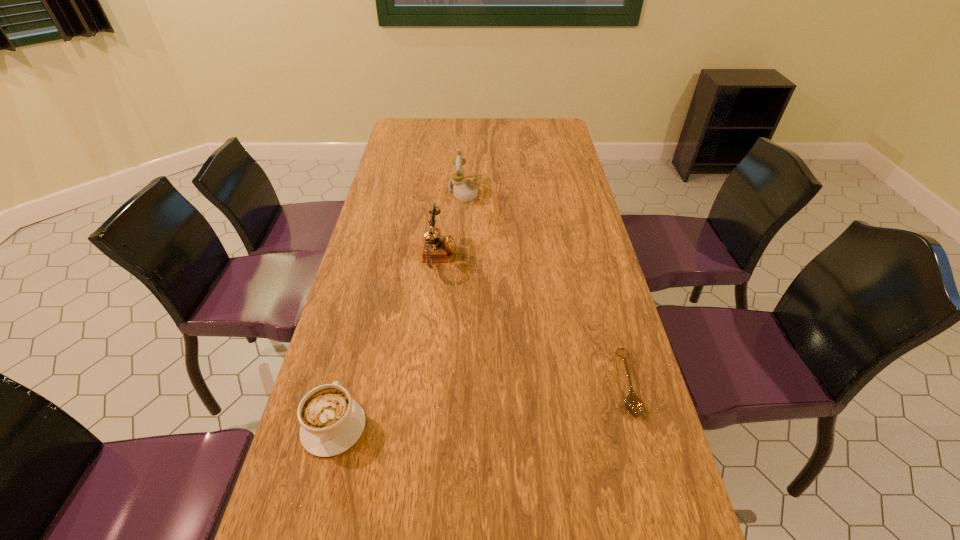
The image size is (960, 540). Find the location of `vacant area that lies between the ladle and the third nearest object`. vacant area that lies between the ladle and the third nearest object is located at coordinates (533, 321).

The height and width of the screenshot is (540, 960). I want to click on unoccupied area between the leftmost object and the nearer telephone, so click(387, 342).

Find the location of a particular element. free spot between the ladle and the nearer telephone is located at coordinates (533, 321).

Where is `free area in between the third tallest object and the farthest object`? free area in between the third tallest object and the farthest object is located at coordinates (398, 308).

Locate an element on the screen. The height and width of the screenshot is (540, 960). vacant area that lies between the cappuccino and the farthest object is located at coordinates (398, 308).

Image resolution: width=960 pixels, height=540 pixels. In order to click on unoccupied position between the ladle and the third nearest object in this screenshot , I will do `click(533, 321)`.

I want to click on free spot between the second shortest object and the shortest object, so click(x=480, y=404).

You are a GUI agent. You are given a task and a screenshot of the screen. Output one action in this format:
    pyautogui.click(x=<x>, y=<y>)
    Task: Click on the vacant point located between the rightmost object and the third tallest object
    Image resolution: width=960 pixels, height=540 pixels.
    Given the screenshot: What is the action you would take?
    pyautogui.click(x=480, y=404)

Locate an element on the screen. object that stands as the closest to the cappuccino is located at coordinates (436, 248).

Identify the location of the second closest object to the nearer telephone. (331, 422).